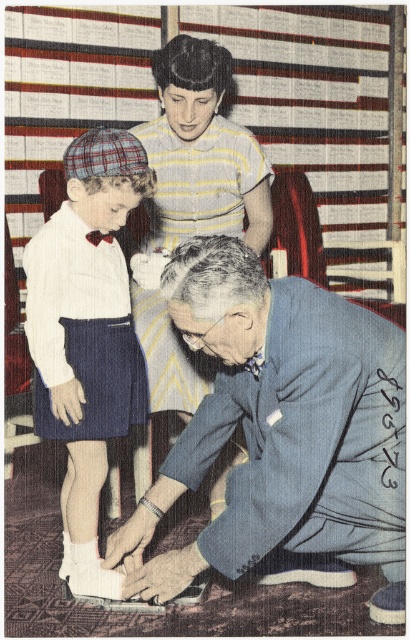
Who is shorter, blue fabric suit at lower center or striped fabric dress at upper center?

blue fabric suit at lower center is shorter.

Is blue fabric suit at lower center to the left of striped fabric dress at upper center from the viewer's perspective?

In fact, blue fabric suit at lower center is to the right of striped fabric dress at upper center.

Locate an element on the screen. blue fabric suit at lower center is located at coordinates (280, 428).

Locate an element on the screen. The height and width of the screenshot is (640, 410). blue fabric suit at lower center is located at coordinates click(280, 428).

Where is `matte plaid cap at left`? This screenshot has height=640, width=410. matte plaid cap at left is located at coordinates (86, 336).

The width and height of the screenshot is (410, 640). I want to click on matte plaid cap at left, so click(x=86, y=336).

This screenshot has width=410, height=640. I want to click on matte plaid cap at left, so [86, 336].

Does blue fabric suit at lower center have a lesser width compared to matte plaid cap at left?

No, blue fabric suit at lower center is not thinner than matte plaid cap at left.

Is blue fabric suit at lower center below matte plaid cap at left?

Correct, blue fabric suit at lower center is located below matte plaid cap at left.

What do you see at coordinates (280, 428) in the screenshot? I see `blue fabric suit at lower center` at bounding box center [280, 428].

What are the coordinates of `blue fabric suit at lower center` in the screenshot? It's located at (280, 428).